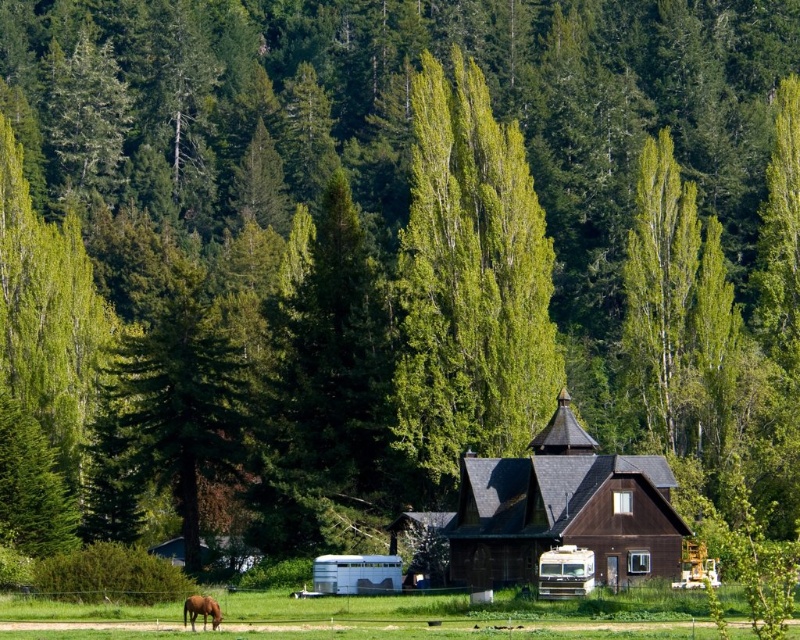
Can you confirm if green grass at lower center is wider than silver metallic trailer at center?

Indeed, green grass at lower center has a greater width compared to silver metallic trailer at center.

Which is above, green grass at lower center or silver metallic trailer at center?

green grass at lower center is higher up.

Does point (666, 621) come closer to viewer compared to point (393, 592)?

Yes, point (666, 621) is in front of point (393, 592).

Where is `green grass at lower center`? The image size is (800, 640). green grass at lower center is located at coordinates (470, 614).

Between brown wooden barn at center and brown glossy horse at lower left, which one appears on the right side from the viewer's perspective?

brown wooden barn at center is more to the right.

Is point (680, 538) farther from camera compared to point (212, 618)?

That is True.

Is point (560, 513) positioned before point (186, 605)?

That is False.

Find the location of a particular element. The height and width of the screenshot is (640, 800). brown wooden barn at center is located at coordinates click(x=564, y=509).

Is green coniferous tree at center-left below brown glossy horse at lower left?

No.

Between point (162, 321) and point (210, 604), which one is positioned in front?

Positioned in front is point (210, 604).

The height and width of the screenshot is (640, 800). What do you see at coordinates (173, 406) in the screenshot? I see `green coniferous tree at center-left` at bounding box center [173, 406].

At what (x,y) coordinates should I click in order to perform the action: click on green coniferous tree at center-left. Please return your answer as a coordinate pair (x, y). This screenshot has height=640, width=800. Looking at the image, I should click on (173, 406).